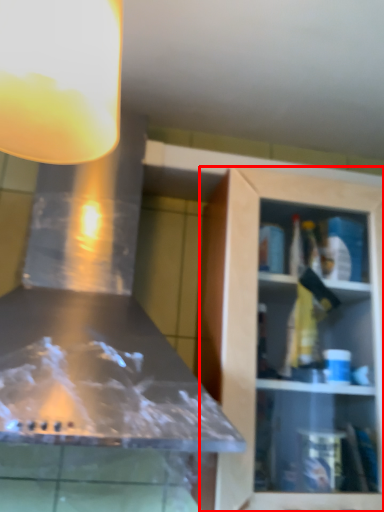
Question: From the image's perspective, considering the relative positions of cabinetry (annotated by the red box) and light fixture in the image provided, where is cabinetry (annotated by the red box) located with respect to the staircase?

Choices:
 (A) above
 (B) below

Answer: (B)